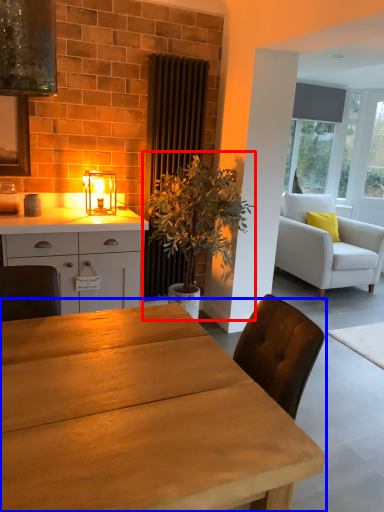
Question: Which point is further to the camera, houseplant (highlighted by a red box) or table (highlighted by a blue box)?

Choices:
 (A) houseplant
 (B) table

Answer: (A)